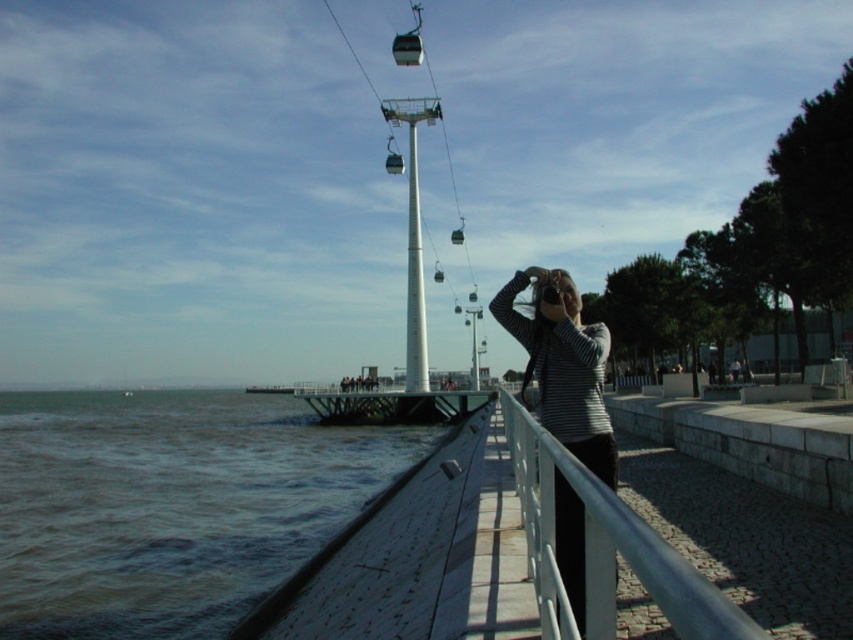
You are a photographer standing on the walkway. You notice the brown water at lower left and the striped fabric at center in your viewfinder. Which object occupies more space in the frame?

The brown water at lower left occupies more space in the frame since it is bigger than the striped fabric at center.

You are standing at the cable car station and want to take a photo of the brown water at lower left. If your camera has a 10 meter range, will you be able to capture it?

The brown water at lower left and viewer are 11.12 meters apart, so the camera with a 10 meter range cannot capture it.